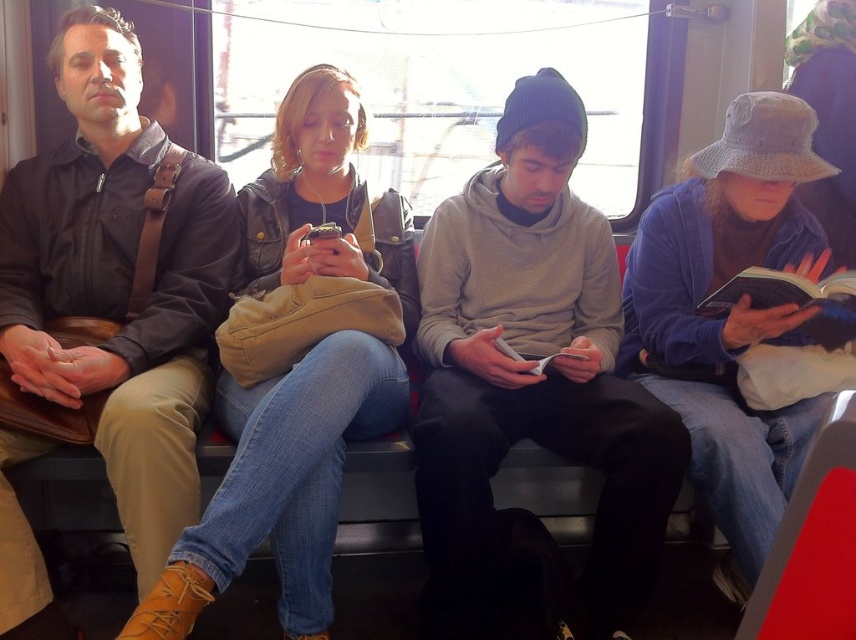
Question: Which point is closer to the camera?

Choices:
 (A) gray hoodie at center
 (B) brown leather jacket at left

Answer: (B)

Question: Does gray hoodie at center appear on the right side of brown leather jacket at left?

Choices:
 (A) yes
 (B) no

Answer: (A)

Question: Is gray hoodie at center further to camera compared to brown leather jacket at left?

Choices:
 (A) yes
 (B) no

Answer: (A)

Question: Does gray hoodie at center have a lesser width compared to brown leather jacket at left?

Choices:
 (A) no
 (B) yes

Answer: (A)

Question: Among these objects, which one is farthest from the camera?

Choices:
 (A) brown leather jacket at left
 (B) gray hoodie at center

Answer: (B)